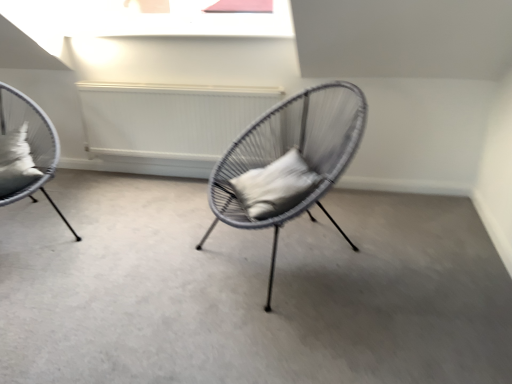
Question: Is white soft pillow at left, which ranks as the first pillow in left-to-right order, positioned far away from woven wire chair at center, the first chair viewed from the right?

Choices:
 (A) no
 (B) yes

Answer: (B)

Question: From a real-world perspective, is white soft pillow at left, the second pillow from the right, located higher than woven wire chair at center, the first chair viewed from the right?

Choices:
 (A) yes
 (B) no

Answer: (A)

Question: Is white soft pillow at left, the second pillow from the right, at the right side of woven wire chair at center, which is the 2th chair in left-to-right order?

Choices:
 (A) no
 (B) yes

Answer: (A)

Question: Is white soft pillow at left, which ranks as the first pillow in left-to-right order, positioned before woven wire chair at center, the first chair viewed from the right?

Choices:
 (A) yes
 (B) no

Answer: (B)

Question: Is white soft pillow at left, the second pillow from the right, completely or partially outside of woven wire chair at center, the first chair viewed from the right?

Choices:
 (A) yes
 (B) no

Answer: (A)

Question: From the image's perspective, would you say white soft pillow at left, which ranks as the first pillow in left-to-right order, is positioned over woven wire chair at center, which is the 2th chair in left-to-right order?

Choices:
 (A) no
 (B) yes

Answer: (B)

Question: Does matte gray chair at center have a lesser width compared to woven wire chair at center, which is the 2th chair in left-to-right order?

Choices:
 (A) no
 (B) yes

Answer: (A)

Question: Is matte gray chair at center not inside woven wire chair at center, the first chair viewed from the right?

Choices:
 (A) no
 (B) yes

Answer: (B)

Question: Does matte gray chair at center have a greater height compared to woven wire chair at center, the first chair viewed from the right?

Choices:
 (A) yes
 (B) no

Answer: (B)

Question: Is matte gray chair at center smaller than woven wire chair at center, the first chair viewed from the right?

Choices:
 (A) no
 (B) yes

Answer: (B)

Question: Is matte gray chair at center shorter than woven wire chair at center, the first chair viewed from the right?

Choices:
 (A) no
 (B) yes

Answer: (B)

Question: Can you confirm if matte gray chair at center is positioned to the left of woven wire chair at center, the first chair viewed from the right?

Choices:
 (A) yes
 (B) no

Answer: (A)

Question: From a real-world perspective, is white soft pillow at left, which ranks as the first pillow in left-to-right order, positioned under matte grey wicker chair at left, the second chair viewed from the right, based on gravity?

Choices:
 (A) yes
 (B) no

Answer: (B)